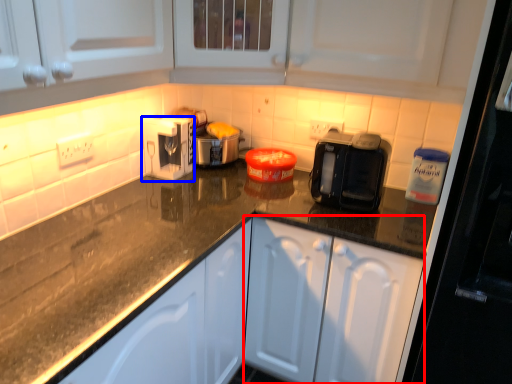
Question: Which object is closer to the camera taking this photo, cabinetry (highlighted by a red box) or kitchen appliance (highlighted by a blue box)?

Choices:
 (A) cabinetry
 (B) kitchen appliance

Answer: (A)